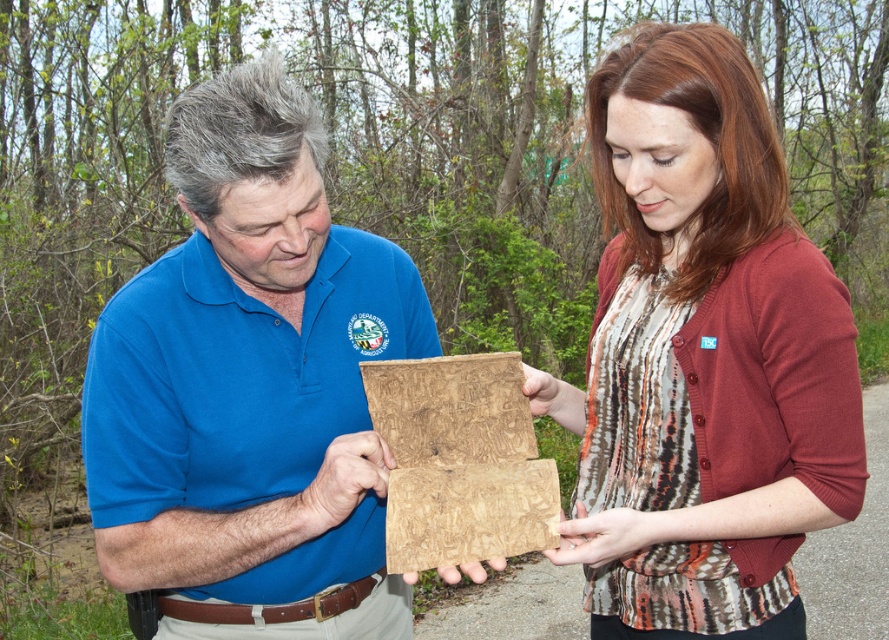
Question: Which point is farther to the camera?

Choices:
 (A) matte brown wood at center
 (B) wooden board at center

Answer: (A)

Question: Which object is positioned farthest from the wooden board at center?

Choices:
 (A) matte brown wood at center
 (B) matte wood board at center

Answer: (A)

Question: Is matte brown wood at center bigger than wooden board at center?

Choices:
 (A) yes
 (B) no

Answer: (A)

Question: Observing the image, what is the correct spatial positioning of matte wood board at center in reference to matte brown wood at center?

Choices:
 (A) left
 (B) right

Answer: (A)

Question: Among these points, which one is farthest from the camera?

Choices:
 (A) (361, 259)
 (B) (525, 529)
 (C) (687, 147)

Answer: (A)

Question: Can you confirm if matte brown wood at center is positioned to the right of wooden board at center?

Choices:
 (A) no
 (B) yes

Answer: (B)